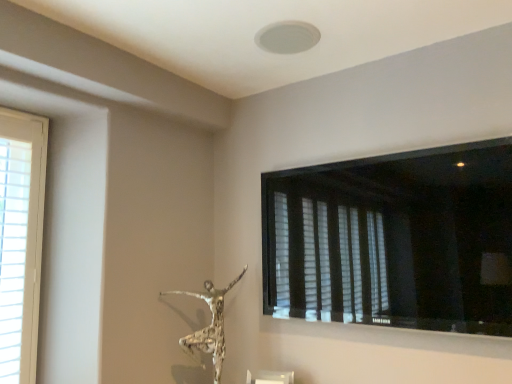
Question: Is black matte window at upper right, which is counted as the 1th window, starting from the right, further to the viewer compared to silver textured sculpture at center?

Choices:
 (A) yes
 (B) no

Answer: (B)

Question: Can you see black matte window at upper right, which appears as the 2th window when viewed from the left, touching silver textured sculpture at center?

Choices:
 (A) no
 (B) yes

Answer: (A)

Question: From the image's perspective, is black matte window at upper right, which is counted as the 1th window, starting from the right, on top of silver textured sculpture at center?

Choices:
 (A) yes
 (B) no

Answer: (A)

Question: Is there a large distance between black matte window at upper right, which appears as the 2th window when viewed from the left, and silver textured sculpture at center?

Choices:
 (A) yes
 (B) no

Answer: (B)

Question: Is black matte window at upper right, which appears as the 2th window when viewed from the left, looking in the opposite direction of silver textured sculpture at center?

Choices:
 (A) yes
 (B) no

Answer: (B)

Question: From a real-world perspective, is silver textured sculpture at center above or below white wood window at left, acting as the 2th window starting from the right?

Choices:
 (A) below
 (B) above

Answer: (A)

Question: Would you say silver textured sculpture at center is to the left or to the right of white wood window at left, acting as the 2th window starting from the right, in the picture?

Choices:
 (A) right
 (B) left

Answer: (A)

Question: Based on their sizes in the image, would you say silver textured sculpture at center is bigger or smaller than white wood window at left, which is counted as the 1th window, starting from the left?

Choices:
 (A) big
 (B) small

Answer: (A)

Question: Considering the positions of silver textured sculpture at center and white wood window at left, acting as the 2th window starting from the right, in the image, is silver textured sculpture at center wider or thinner than white wood window at left, acting as the 2th window starting from the right,?

Choices:
 (A) thin
 (B) wide

Answer: (B)

Question: In terms of height, does white wood window at left, acting as the 2th window starting from the right, look taller or shorter compared to black matte window at upper right, which appears as the 2th window when viewed from the left?

Choices:
 (A) tall
 (B) short

Answer: (A)

Question: Based on their sizes in the image, would you say white wood window at left, acting as the 2th window starting from the right, is bigger or smaller than black matte window at upper right, which is counted as the 1th window, starting from the right?

Choices:
 (A) small
 (B) big

Answer: (A)

Question: From a real-world perspective, relative to black matte window at upper right, which appears as the 2th window when viewed from the left, is white wood window at left, which is counted as the 1th window, starting from the left, vertically above or below?

Choices:
 (A) below
 (B) above

Answer: (A)

Question: In the image, is white wood window at left, acting as the 2th window starting from the right, positioned in front of or behind black matte window at upper right, which appears as the 2th window when viewed from the left?

Choices:
 (A) behind
 (B) front

Answer: (A)

Question: From their relative heights in the image, would you say silver textured sculpture at center is taller or shorter than black matte window at upper right, which appears as the 2th window when viewed from the left?

Choices:
 (A) tall
 (B) short

Answer: (B)

Question: From a real-world perspective, is silver textured sculpture at center above or below black matte window at upper right, which appears as the 2th window when viewed from the left?

Choices:
 (A) above
 (B) below

Answer: (B)